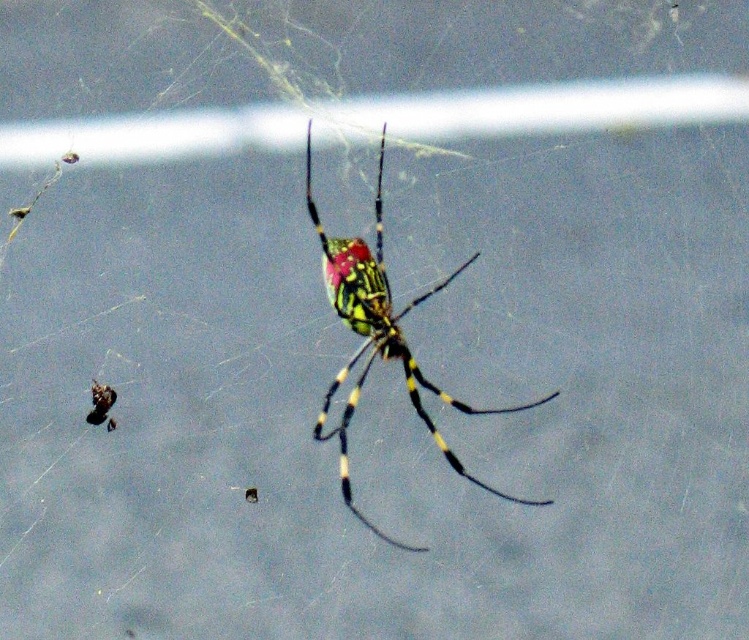
You are a photographer trying to capture a detailed image of the multicolored glossy spider at center and the shiny black insect at lower left. Which one will appear larger in your photo?

The multicolored glossy spider at center will appear larger in the photo because it is closer to the viewer than the shiny black insect at lower left.

You are an entomologist observing a spider web. You notice a multicolored glossy spider at center and a shiny black insect at lower left. Which object is positioned to the right of the other?

The multicolored glossy spider at center is positioned to the right of the shiny black insect at lower left.